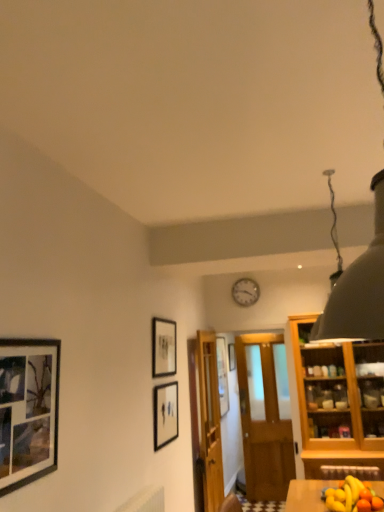
Question: Considering the relative sizes of wooden door at center, marked as the 1th door in a left-to-right arrangement, and wooden table at lower right in the image provided, is wooden door at center, marked as the 1th door in a left-to-right arrangement, taller than wooden table at lower right?

Choices:
 (A) yes
 (B) no

Answer: (A)

Question: From a real-world perspective, is wooden door at center, marked as the 1th door in a left-to-right arrangement, positioned under wooden table at lower right based on gravity?

Choices:
 (A) no
 (B) yes

Answer: (A)

Question: From the image's perspective, is wooden door at center, marked as the 1th door in a left-to-right arrangement, on top of wooden table at lower right?

Choices:
 (A) no
 (B) yes

Answer: (A)

Question: From the image's perspective, is wooden door at center, which is the 2th door in right-to-left order, beneath wooden table at lower right?

Choices:
 (A) yes
 (B) no

Answer: (A)

Question: Considering the relative sizes of wooden door at center, which is the 2th door in right-to-left order, and wooden table at lower right in the image provided, is wooden door at center, which is the 2th door in right-to-left order, smaller than wooden table at lower right?

Choices:
 (A) no
 (B) yes

Answer: (A)

Question: Is white matte lampshade at upper right situated inside matte black picture frame at left, which is the first picture frame in front-to-back order, or outside?

Choices:
 (A) outside
 (B) inside

Answer: (A)

Question: Considering the positions of point (362, 321) and point (23, 482), is point (362, 321) closer or farther from the camera than point (23, 482)?

Choices:
 (A) closer
 (B) farther

Answer: (A)

Question: From the image's perspective, is white matte lampshade at upper right located above or below matte black picture frame at left, which is the first picture frame in front-to-back order?

Choices:
 (A) above
 (B) below

Answer: (A)

Question: Based on their sizes in the image, would you say white matte lampshade at upper right is bigger or smaller than matte black picture frame at left, which is the fifth picture frame in right-to-left order?

Choices:
 (A) small
 (B) big

Answer: (B)

Question: From the image's perspective, is matte black picture frame at upper center, which appears as the 2th picture frame when viewed from the left, positioned above or below wooden door at center, which is the 2th door in right-to-left order?

Choices:
 (A) above
 (B) below

Answer: (A)

Question: Is point (167, 359) positioned closer to the camera than point (205, 446)?

Choices:
 (A) farther
 (B) closer

Answer: (B)

Question: From a real-world perspective, relative to wooden door at center, which is the 2th door in right-to-left order, is matte black picture frame at upper center, the 3th picture frame viewed from the front, vertically above or below?

Choices:
 (A) above
 (B) below

Answer: (A)

Question: From their relative heights in the image, would you say matte black picture frame at upper center, the 4th picture frame when ordered from right to left, is taller or shorter than wooden door at center, marked as the 1th door in a left-to-right arrangement?

Choices:
 (A) short
 (B) tall

Answer: (A)

Question: From the image's perspective, relative to matte black picture frame at upper center, which appears as the 2th picture frame when viewed from the left, is white matte lampshade at upper right above or below?

Choices:
 (A) above
 (B) below

Answer: (A)

Question: Is white matte lampshade at upper right taller or shorter than matte black picture frame at upper center, the 3th picture frame viewed from the front?

Choices:
 (A) short
 (B) tall

Answer: (B)